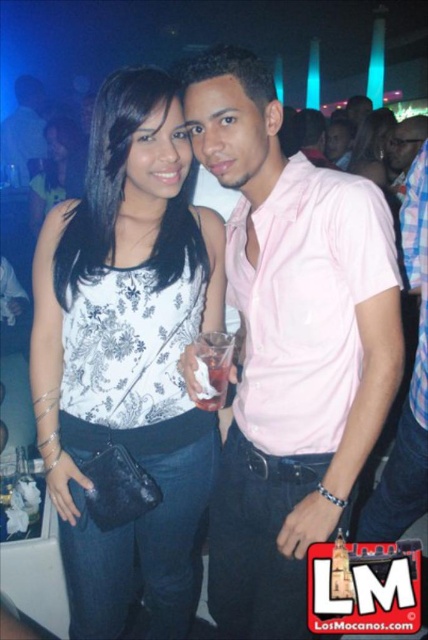
Question: Based on their relative distances, which object is nearer to the pink matte shirt at center?

Choices:
 (A) matte white tank top at center
 (B) white printed tank top at center
 (C) pink cotton shirt at center
 (D) matte black purse at center

Answer: (D)

Question: Which of the following is the farthest from the observer?

Choices:
 (A) matte black purse at center
 (B) pink matte shirt at center

Answer: (B)

Question: Which of these objects is positioned farthest from the white printed tank top at center?

Choices:
 (A) matte black purse at center
 (B) white paper cup at center

Answer: (A)

Question: Is pink cotton shirt at center positioned at the back of matte white tank top at center?

Choices:
 (A) no
 (B) yes

Answer: (A)

Question: Can you confirm if white printed tank top at center is bigger than pink matte shirt at center?

Choices:
 (A) yes
 (B) no

Answer: (A)

Question: Does pink cotton shirt at center appear over matte black purse at center?

Choices:
 (A) yes
 (B) no

Answer: (B)